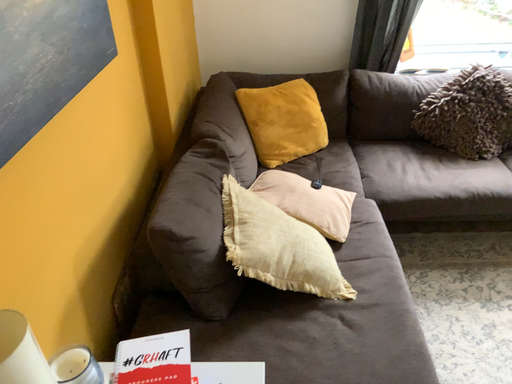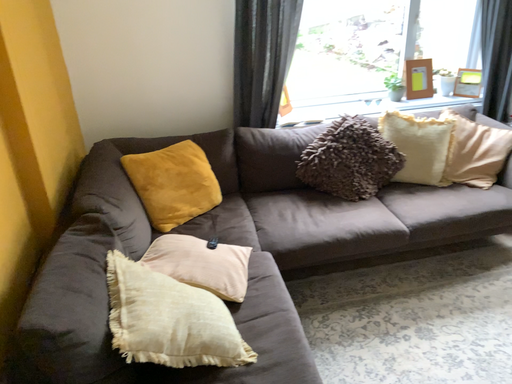
Question: How did the camera likely rotate when shooting the video?

Choices:
 (A) rotated right
 (B) rotated left

Answer: (A)